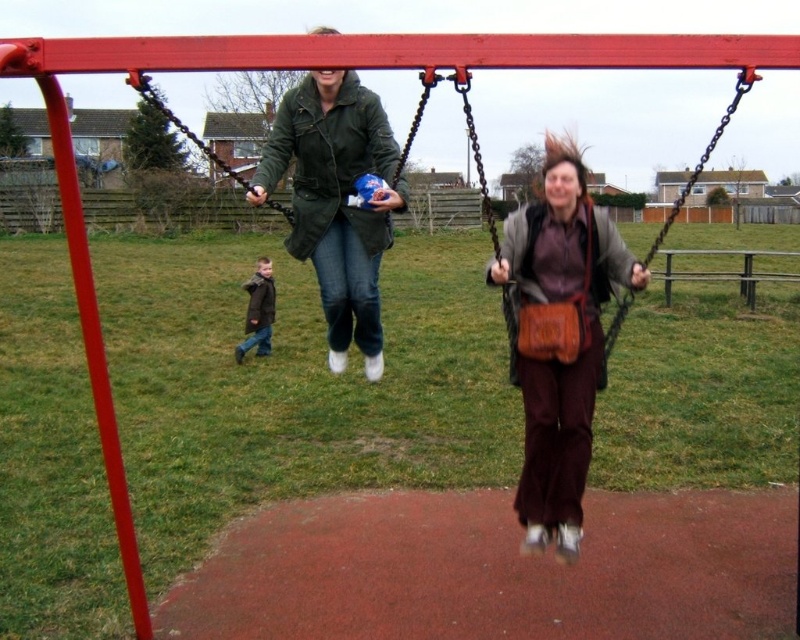
Can you confirm if green matte jacket at center is smaller than brown leather bag at center?

Yes.

Between green matte jacket at center and brown leather bag at center, which one is positioned lower?

Positioned lower is green matte jacket at center.

Find the location of `green matte jacket at center`. green matte jacket at center is located at coordinates (336, 202).

Locate an element on the screen. This screenshot has width=800, height=640. green matte jacket at center is located at coordinates (336, 202).

Can you confirm if brown leather purse at center is bigger than green matte jacket at upper center?

No, brown leather purse at center is not bigger than green matte jacket at upper center.

Which is more to the right, brown leather purse at center or green matte jacket at upper center?

brown leather purse at center

Is point (528, 330) positioned behind point (152, 93)?

Yes, it is behind point (152, 93).

Where is `brown leather purse at center`? This screenshot has width=800, height=640. brown leather purse at center is located at coordinates (550, 332).

Who is shorter, green matte jacket at center or green matte jacket at upper center?

Standing shorter between the two is green matte jacket at center.

Looking at this image, measure the distance between green matte jacket at center and green matte jacket at upper center.

The distance of green matte jacket at center from green matte jacket at upper center is 48.66 feet.

What do you see at coordinates (336, 202) in the screenshot?
I see `green matte jacket at center` at bounding box center [336, 202].

Where is `green matte jacket at center`? green matte jacket at center is located at coordinates 336,202.